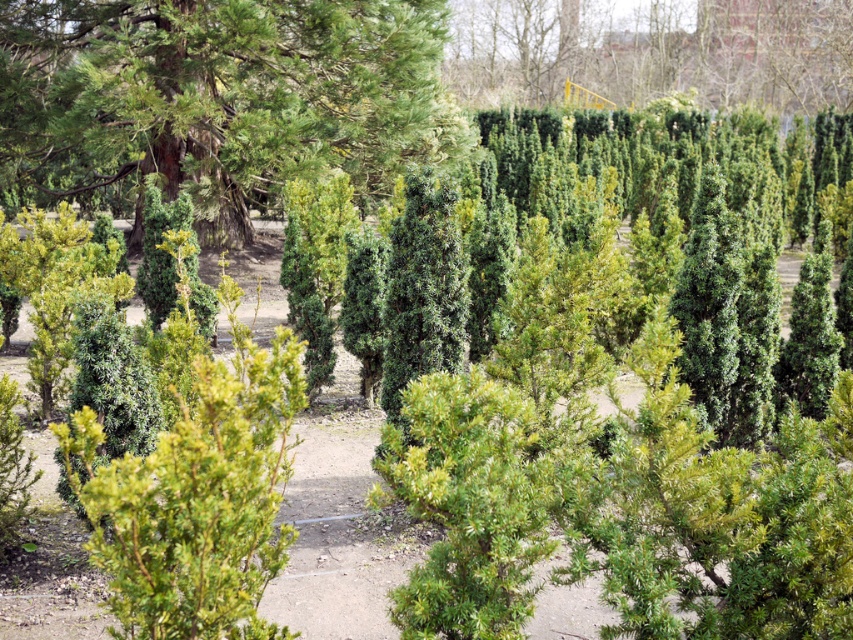
You are standing in the garden and see the point marked at coordinates [218,100]. What object is located at that point?

The green textured tree at upper left is located at point [218,100].

You are standing in the garden and want to reach the point marked as point (111, 56). If your walking speed is 3 feet per second, how many seconds will it take you to reach there?

The distance between you and point (111, 56) is 43.11 feet. At a speed of 3 feet per second, it will take 43.11 divided by 3, which equals approximately 14.37 seconds to reach the point.